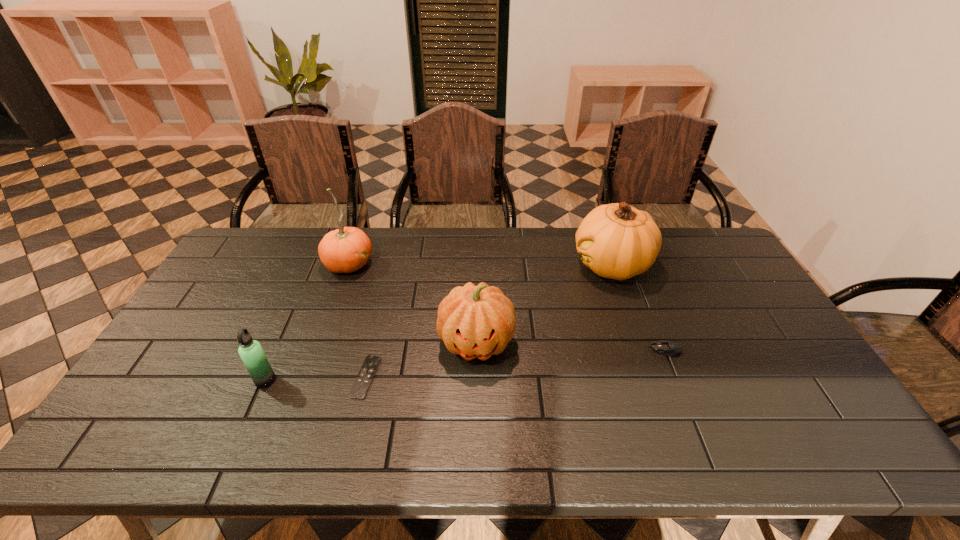
Locate an element on the screen. The image size is (960, 540). the rightmost pumpkin is located at coordinates (617, 241).

Locate an element on the screen. the leftmost pumpkin is located at coordinates (347, 249).

Where is `the third object from right to left`? The height and width of the screenshot is (540, 960). the third object from right to left is located at coordinates (474, 321).

Where is `the nearest pumpkin`? This screenshot has width=960, height=540. the nearest pumpkin is located at coordinates (474, 321).

You are a GUI agent. You are given a task and a screenshot of the screen. Output one action in this format:
    pyautogui.click(x=<x>, y=<y>)
    Task: Click on the thermos bottle
    The image size is (960, 540).
    Given the screenshot: What is the action you would take?
    pyautogui.click(x=250, y=351)

Where is `computer mouse`? The height and width of the screenshot is (540, 960). computer mouse is located at coordinates (665, 347).

Where is `remote control`? The width and height of the screenshot is (960, 540). remote control is located at coordinates (362, 383).

Identify the location of the fourth object from right to left. Image resolution: width=960 pixels, height=540 pixels. (362, 383).

Find the location of a particular element. The image size is (960, 540). vacant point located on the front face of the rightmost pumpkin is located at coordinates (457, 265).

Where is `free space located on the front face of the rightmost pumpkin`? free space located on the front face of the rightmost pumpkin is located at coordinates (460, 265).